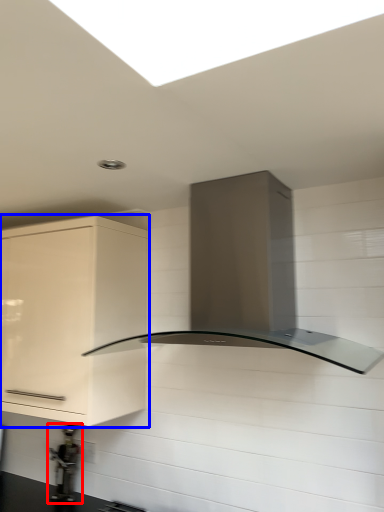
Question: Among these objects, which one is farthest to the camera, appliance (highlighted by a red box) or cabinetry (highlighted by a blue box)?

Choices:
 (A) appliance
 (B) cabinetry

Answer: (A)